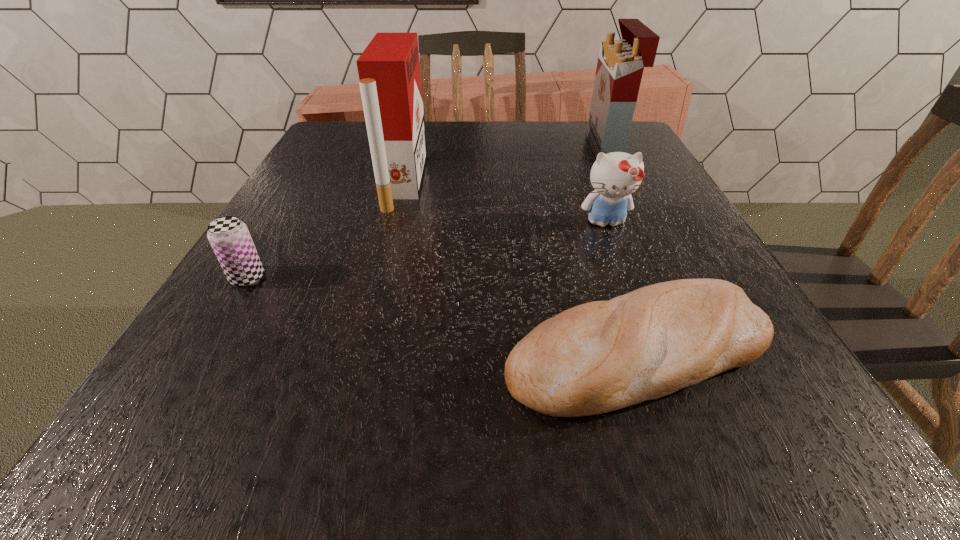
Find the location of `the right cigarette case`. the right cigarette case is located at coordinates (620, 65).

I want to click on the left cigarette case, so click(389, 73).

The width and height of the screenshot is (960, 540). Identify the location of the third tallest object. (615, 176).

Identify the location of the second shortest object. (x=229, y=237).

The width and height of the screenshot is (960, 540). I want to click on the second nearest object, so click(229, 237).

Locate an element on the screen. the shortest object is located at coordinates (601, 356).

Where is `the nearest object`? This screenshot has width=960, height=540. the nearest object is located at coordinates (601, 356).

Where is `free space located with the lid open on the right cigarette case`? The height and width of the screenshot is (540, 960). free space located with the lid open on the right cigarette case is located at coordinates (556, 147).

At what (x,y) coordinates should I click in order to perform the action: click on vacant space located with the lid open on the right cigarette case. Please return your answer as a coordinate pair (x, y). This screenshot has width=960, height=540. Looking at the image, I should click on (536, 147).

Where is `free spot located with the lid open on the right cigarette case`? The image size is (960, 540). free spot located with the lid open on the right cigarette case is located at coordinates (572, 147).